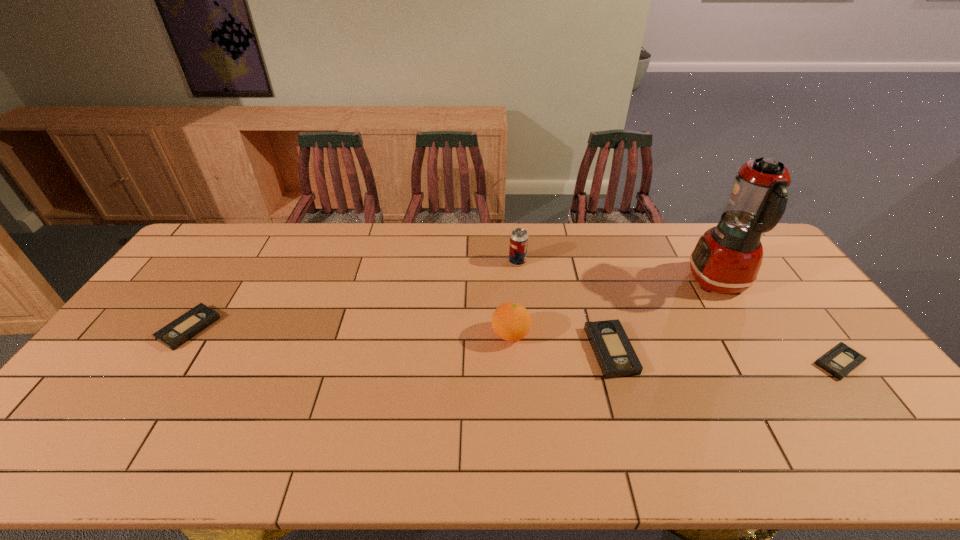
The image size is (960, 540). Identify the location of object located in the left edge section of the desktop. (173, 335).

This screenshot has height=540, width=960. Find the location of `videotape at the right edge`. videotape at the right edge is located at coordinates (841, 360).

At what (x,y) coordinates should I click in order to perform the action: click on food processor that is at the right edge. Please return your answer as a coordinate pair (x, y). Looking at the image, I should click on (727, 258).

Locate an element on the screen. object at the far right corner is located at coordinates (727, 258).

I want to click on vacant position at the far edge of the desktop, so click(x=310, y=242).

The width and height of the screenshot is (960, 540). In the image, there is a desktop. Find the location of `blank space at the near edge`. blank space at the near edge is located at coordinates pos(408,406).

In the image, there is a desktop. Find the location of `vacant space at the left edge`. vacant space at the left edge is located at coordinates (135, 372).

You are a GUI agent. You are given a task and a screenshot of the screen. Output one action in this format:
    pyautogui.click(x=<x>, y=<y>)
    Task: Click on the vacant space at the right edge of the desktop
    
    Given the screenshot: What is the action you would take?
    pyautogui.click(x=802, y=302)

Where is `blank region between the food processor and the leftmost videotape`? This screenshot has height=540, width=960. blank region between the food processor and the leftmost videotape is located at coordinates (454, 306).

Identify the location of vacant region between the fourth tallest object and the fifth object from left to right. The image size is (960, 540). (664, 316).